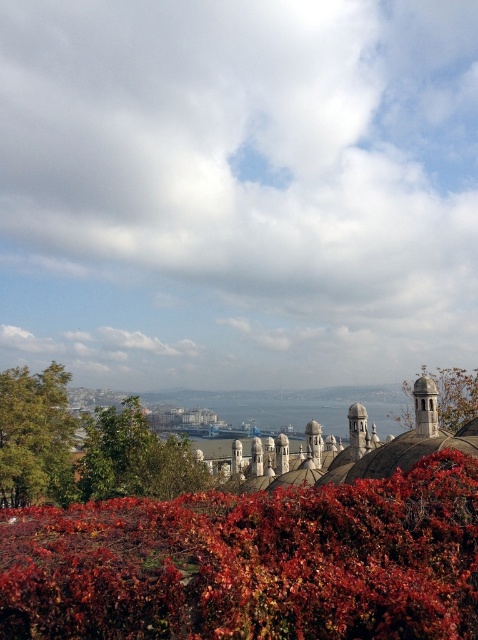
Question: Which object appears farthest from the camera in this image?

Choices:
 (A) green leafy tree at lower left
 (B) green leafy tree at upper left
 (C) green matte dome at upper center
 (D) leather-like red foliage at center

Answer: (B)

Question: Considering the relative positions of leather-like red foliage at center and green matte dome at upper center in the image provided, where is leather-like red foliage at center located with respect to green matte dome at upper center?

Choices:
 (A) above
 (B) below

Answer: (A)

Question: Is green leafy tree at upper left thinner than green leafy tree at lower left?

Choices:
 (A) no
 (B) yes

Answer: (B)

Question: Which point is closer to the camera?

Choices:
 (A) green leafy tree at upper left
 (B) green leafy tree at lower left

Answer: (B)

Question: Does green leafy tree at lower left have a lesser width compared to green matte dome at upper center?

Choices:
 (A) yes
 (B) no

Answer: (A)

Question: Among these objects, which one is farthest from the camera?

Choices:
 (A) green matte dome at upper center
 (B) leather-like red foliage at center
 (C) green leafy tree at upper left

Answer: (C)